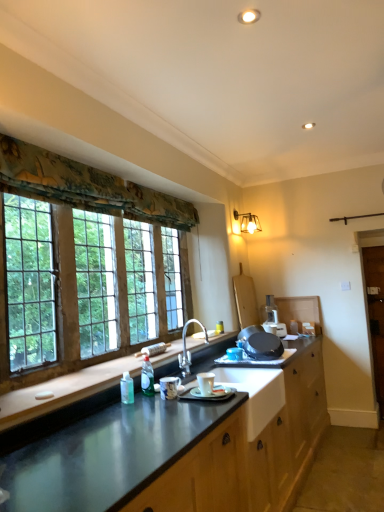
Question: From the image's perspective, would you say metallic wall sconce at upper right is shown under brown wooden barn door at right?

Choices:
 (A) yes
 (B) no

Answer: (B)

Question: Considering the relative positions of metallic wall sconce at upper right and brown wooden barn door at right in the image provided, is metallic wall sconce at upper right in front of brown wooden barn door at right?

Choices:
 (A) no
 (B) yes

Answer: (A)

Question: Is metallic wall sconce at upper right thinner than brown wooden barn door at right?

Choices:
 (A) yes
 (B) no

Answer: (B)

Question: Considering the relative positions of metallic wall sconce at upper right and brown wooden barn door at right in the image provided, is metallic wall sconce at upper right behind brown wooden barn door at right?

Choices:
 (A) no
 (B) yes

Answer: (B)

Question: From a real-world perspective, is metallic wall sconce at upper right located beneath brown wooden barn door at right?

Choices:
 (A) yes
 (B) no

Answer: (B)

Question: Is point (38, 193) closer or farther from the camera than point (284, 332)?

Choices:
 (A) farther
 (B) closer

Answer: (B)

Question: Is floral fabric curtain at upper left inside the boundaries of white plastic food processor at center, or outside?

Choices:
 (A) inside
 (B) outside

Answer: (B)

Question: In terms of width, does floral fabric curtain at upper left look wider or thinner when compared to white plastic food processor at center?

Choices:
 (A) wide
 (B) thin

Answer: (B)

Question: Considering the positions of floral fabric curtain at upper left and white plastic food processor at center in the image, is floral fabric curtain at upper left taller or shorter than white plastic food processor at center?

Choices:
 (A) short
 (B) tall

Answer: (A)

Question: Is brown wooden barn door at right taller or shorter than metallic wall sconce at upper right?

Choices:
 (A) tall
 (B) short

Answer: (A)

Question: Choose the correct answer: Is brown wooden barn door at right inside metallic wall sconce at upper right or outside it?

Choices:
 (A) inside
 (B) outside

Answer: (B)

Question: Considering the positions of point (380, 375) and point (253, 215), is point (380, 375) closer or farther from the camera than point (253, 215)?

Choices:
 (A) closer
 (B) farther

Answer: (A)

Question: In the image, is brown wooden barn door at right positioned in front of or behind metallic wall sconce at upper right?

Choices:
 (A) behind
 (B) front

Answer: (B)

Question: Is white plastic food processor at center to the left or to the right of floral fabric curtain at upper left in the image?

Choices:
 (A) right
 (B) left

Answer: (A)

Question: From a real-world perspective, is white plastic food processor at center positioned above or below floral fabric curtain at upper left?

Choices:
 (A) above
 (B) below

Answer: (B)